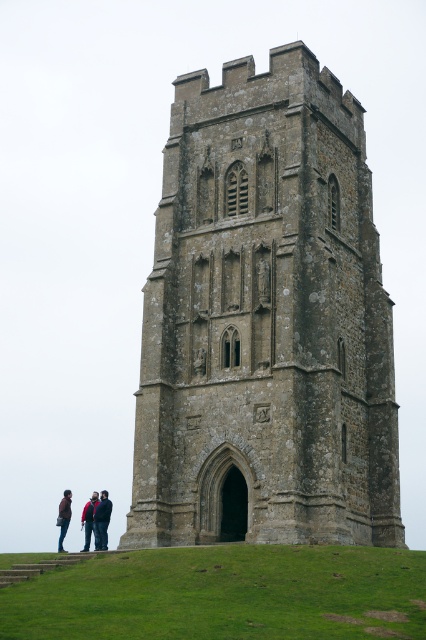
You are a tourist visiting the historic stone tower and want to take a photo of the tower with both the green grass at lower center and the dark blue jacket at lower left in the frame. Can you stand at a position where both objects are visible in the same photo?

The green grass at lower center and dark blue jacket at lower left are 15.41 meters apart. Since the distance between them is not excessively large, you can likely position yourself at a point that allows both to be captured in the same photo frame, provided the camera lens has an appropriate angle of view.